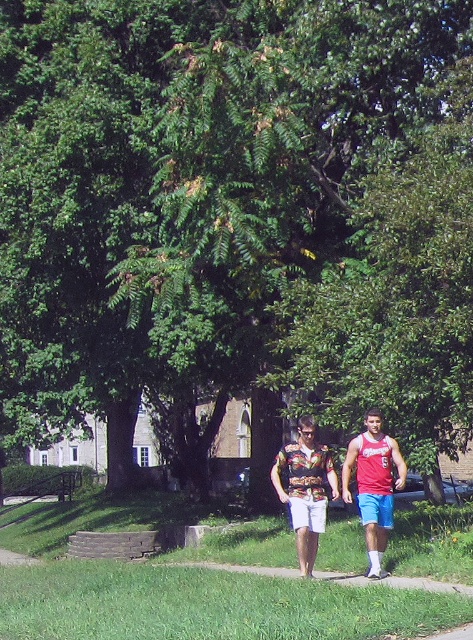
Consider the image. You are a photographer trying to capture a photo of both the red fabric tank top at center and the hawaiian print shirt at center. Since you want to ensure both are in focus, you need to know which one is taller. Which one should you focus on first to ensure the taller one is in focus?

The red fabric tank top at center is much taller than the hawaiian print shirt at center, so you should focus on the red fabric tank top at center first to ensure the taller one is in focus.

You are a photographer trying to capture a photo of both the floral fabric shirt at center and the red fabric tank top at center. Which one should you focus on first to ensure both are in the frame?

The floral fabric shirt at center is positioned under the red fabric tank top at center, so you should focus on the red fabric tank top at center first to ensure both are in the frame.

You are a photographer trying to capture a photo of both the floral fabric shirt at center and the hawaiian print shirt at center. Which person should you focus on first to ensure both are in the frame?

The floral fabric shirt at center is in front of the hawaiian print shirt at center, so you should focus on the hawaiian print shirt at center first to ensure both are fully visible in the frame.